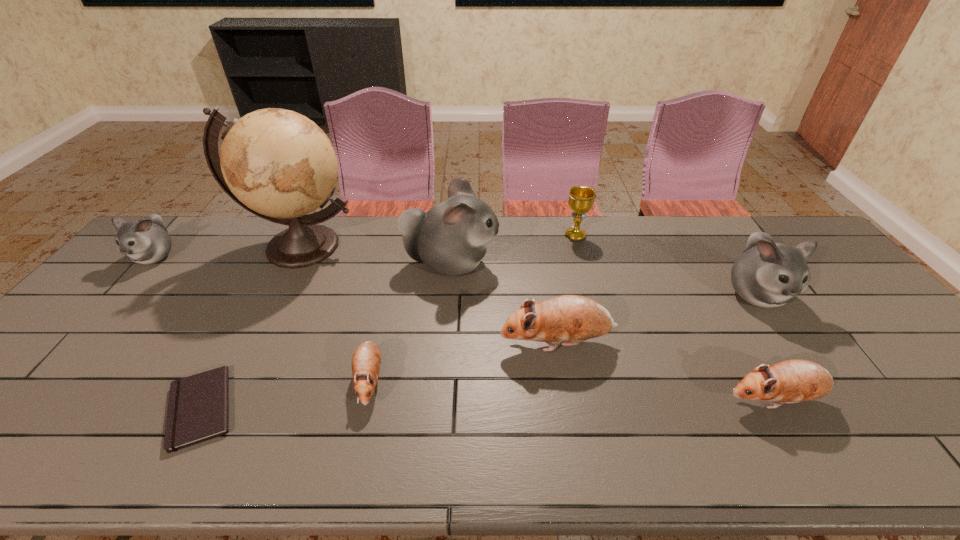
Image resolution: width=960 pixels, height=540 pixels. What are the coordinates of `the rightmost brown hamster` in the screenshot? It's located at (792, 381).

Find the location of `the smallest brown hamster`. the smallest brown hamster is located at coordinates (366, 361).

Image resolution: width=960 pixels, height=540 pixels. Identify the location of the leftmost brown hamster. (366, 361).

The image size is (960, 540). In order to click on checkbook in this screenshot , I will do `click(198, 408)`.

The image size is (960, 540). I want to click on free space located 0.290m on the front-facing side of the globe, so click(248, 352).

The height and width of the screenshot is (540, 960). Identify the location of blank area located on the face of the biggest white hamster. (517, 264).

Locate an element on the screen. free spot located 0.190m on the face of the rightmost white hamster is located at coordinates (816, 383).

Find the location of a particular element. This screenshot has height=540, width=960. vacant position located on the left of the gold chalice is located at coordinates (530, 236).

I want to click on vacant space located 0.370m on the face of the leftmost white hamster, so click(51, 373).

Identify the location of vacant space positioned at the face of the biggest brown hamster. The width and height of the screenshot is (960, 540). 480,343.